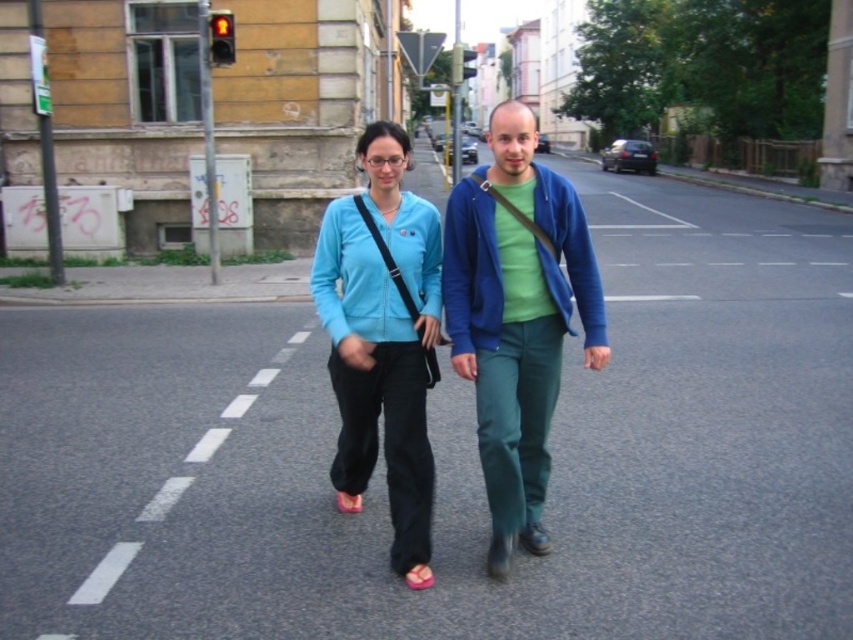
From the picture: You are a pedestrian trying to cross the street and see two people ahead of you. One is wearing a matte blue jacket at center and the other a matte blue sweater at center. Which one is closer to you?

The matte blue jacket at center is closer to the viewer than the matte blue sweater at center.